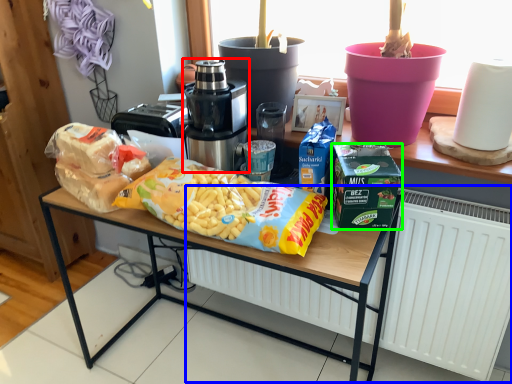
Question: Considering the real-world distances, which object is closest to home appliance (highlighted by a red box)? radiator (highlighted by a blue box) or lunch box (highlighted by a green box).

Choices:
 (A) radiator
 (B) lunch box

Answer: (B)